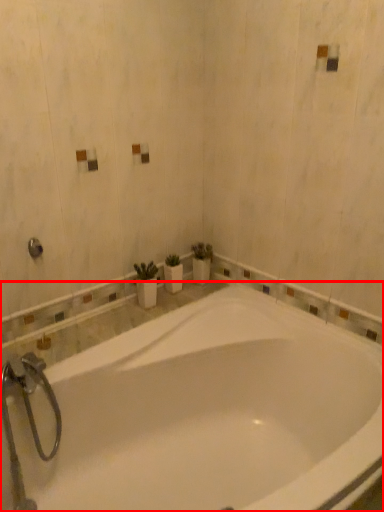
Question: Considering the relative positions of bathtub (annotated by the red box) and shower in the image provided, where is bathtub (annotated by the red box) located with respect to the staircase?

Choices:
 (A) right
 (B) left

Answer: (A)